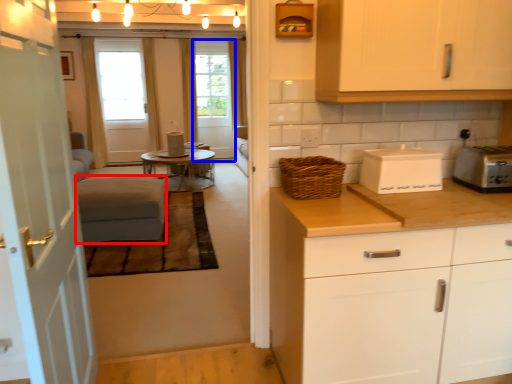
Question: Which of the following is the closest to the observer, couch (highlighted by a red box) or screen door (highlighted by a blue box)?

Choices:
 (A) couch
 (B) screen door

Answer: (A)